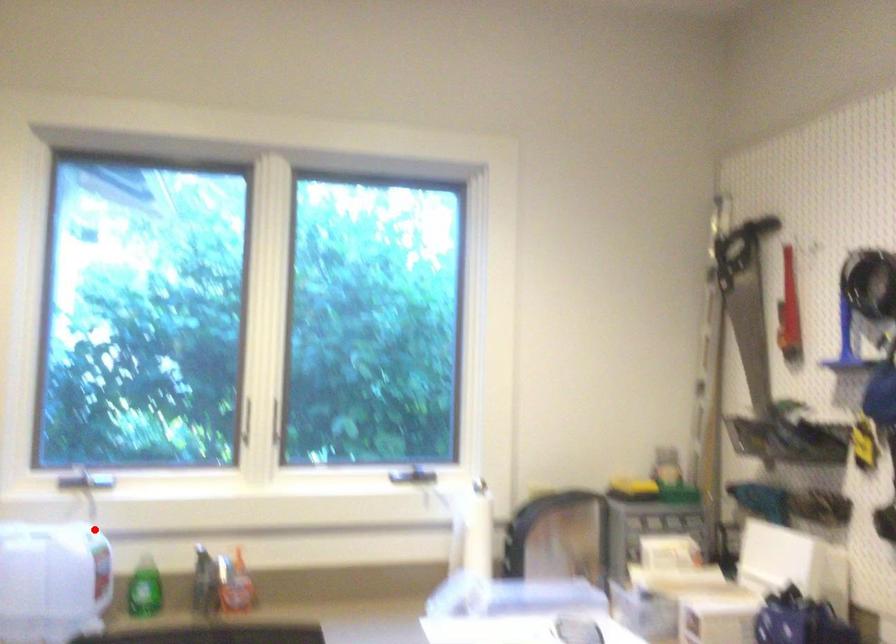
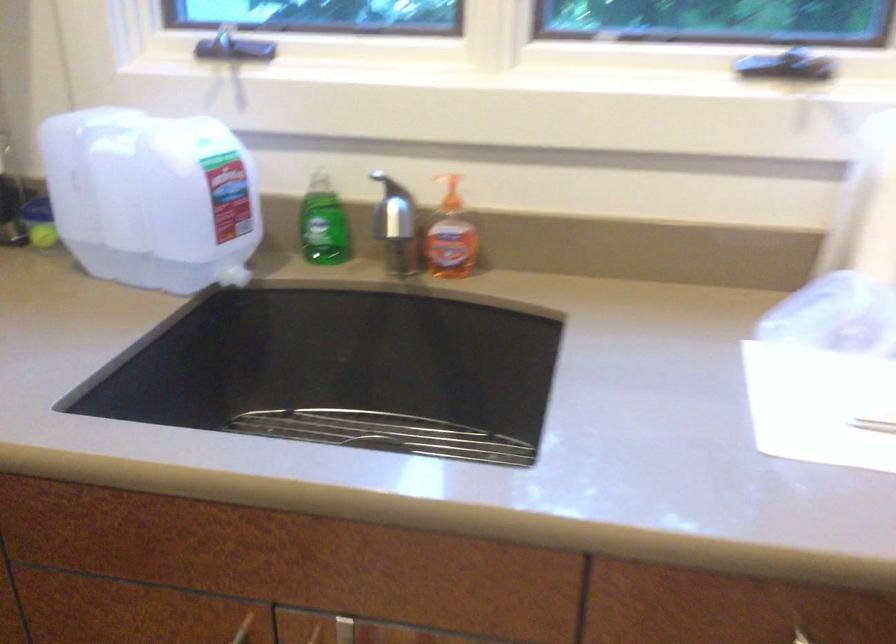
Question: I am providing you with two images of the same scene from different viewpoints. In image1, a red point is highlighted. Considering the same 3D point in image2, which of the following is correct?

Choices:
 (A) It is closer
 (B) It is farther

Answer: (A)